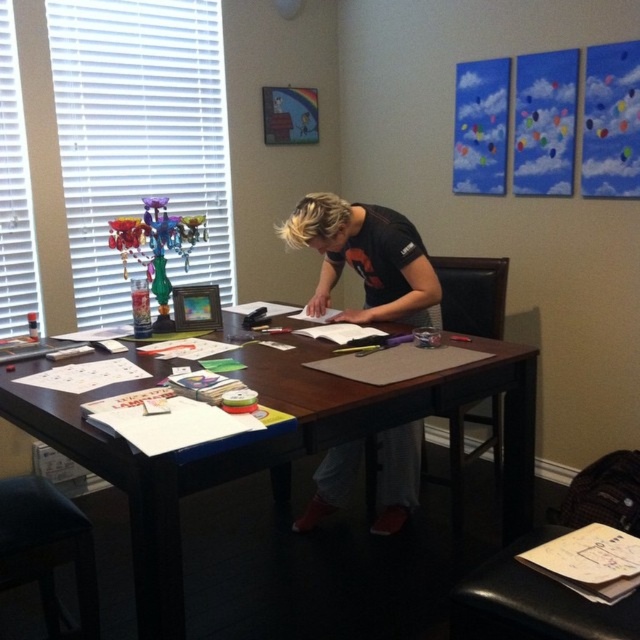
Is wooden table at center positioned behind black fabric shirt at center?

No, wooden table at center is closer to the viewer.

Is wooden table at center taller than black fabric shirt at center?

Yes.

Between point (275, 390) and point (381, 532), which one is positioned in front?

Point (275, 390) is more forward.

Image resolution: width=640 pixels, height=640 pixels. What are the coordinates of `wooden table at center` in the screenshot? It's located at (301, 486).

Does black fabric shirt at center have a greater width compared to black leather stool at lower left?

Yes.

Who is more forward, (x=406, y=264) or (x=8, y=504)?

Point (x=8, y=504) is more forward.

Who is more distant from viewer, (381, 289) or (17, 540)?

The point (381, 289) is more distant.

Locate an element on the screen. black fabric shirt at center is located at coordinates (365, 259).

Does wooden table at center appear on the left side of black leather stool at lower left?

No, wooden table at center is not to the left of black leather stool at lower left.

In the scene shown: Does wooden table at center lie in front of black leather stool at lower left?

Yes, wooden table at center is in front of black leather stool at lower left.

Find the location of a particular element. The height and width of the screenshot is (640, 640). wooden table at center is located at coordinates (301, 486).

Where is `wooden table at center`? wooden table at center is located at coordinates (301, 486).